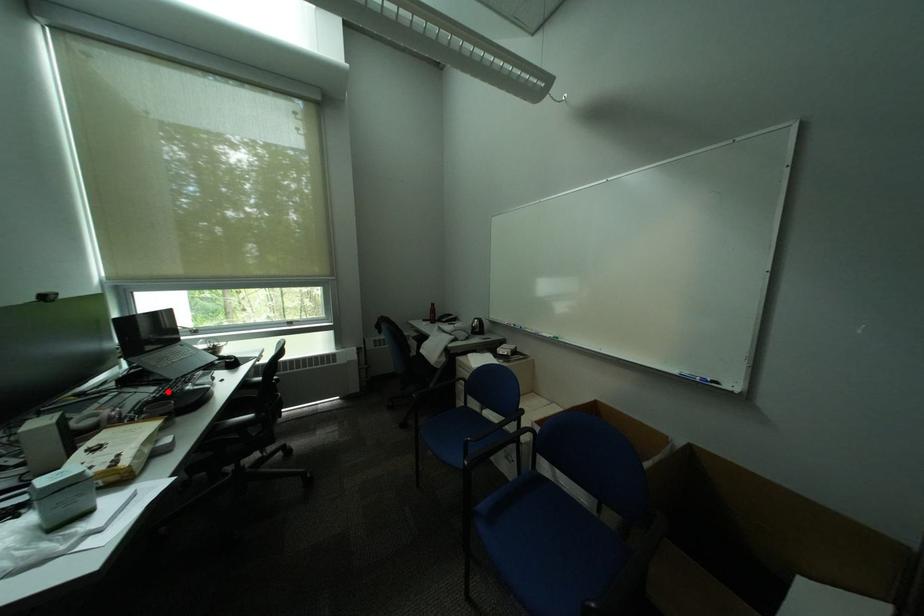
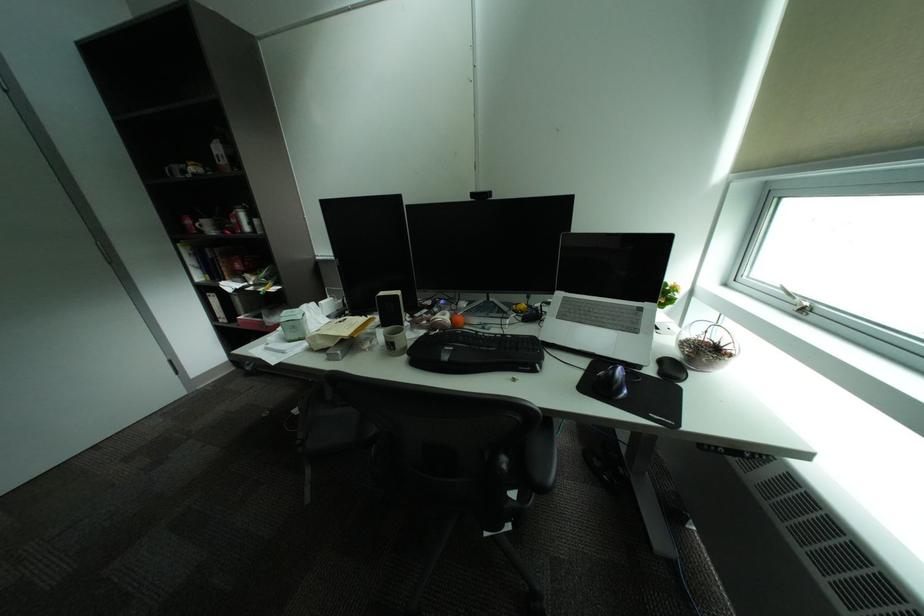
Where in the second image is the point corresponding to the highlighted location from the first image?

(516, 336)